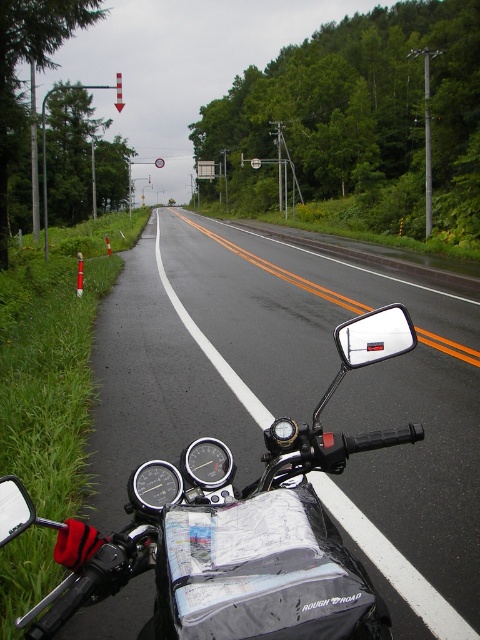
Question: Can you confirm if black matte motorcycle at center is thinner than clear plastic mirror at center?

Choices:
 (A) no
 (B) yes

Answer: (A)

Question: Which object appears closest to the camera in this image?

Choices:
 (A) clear plastic mirror at center
 (B) black matte motorcycle at center

Answer: (B)

Question: Which point is closer to the camera taking this photo?

Choices:
 (A) (364, 316)
 (B) (47, 632)

Answer: (B)

Question: Does black matte motorcycle at center appear over clear plastic mirror at center?

Choices:
 (A) yes
 (B) no

Answer: (B)

Question: Where is black matte motorcycle at center located in relation to clear plastic mirror at center in the image?

Choices:
 (A) below
 (B) above

Answer: (A)

Question: Which of the following is the closest to the observer?

Choices:
 (A) black matte motorcycle at center
 (B) clear plastic mirror at center

Answer: (A)